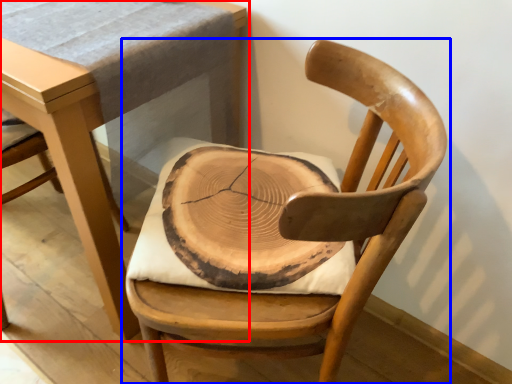
Question: Which object is further to the camera taking this photo, table (highlighted by a red box) or chair (highlighted by a blue box)?

Choices:
 (A) table
 (B) chair

Answer: (A)